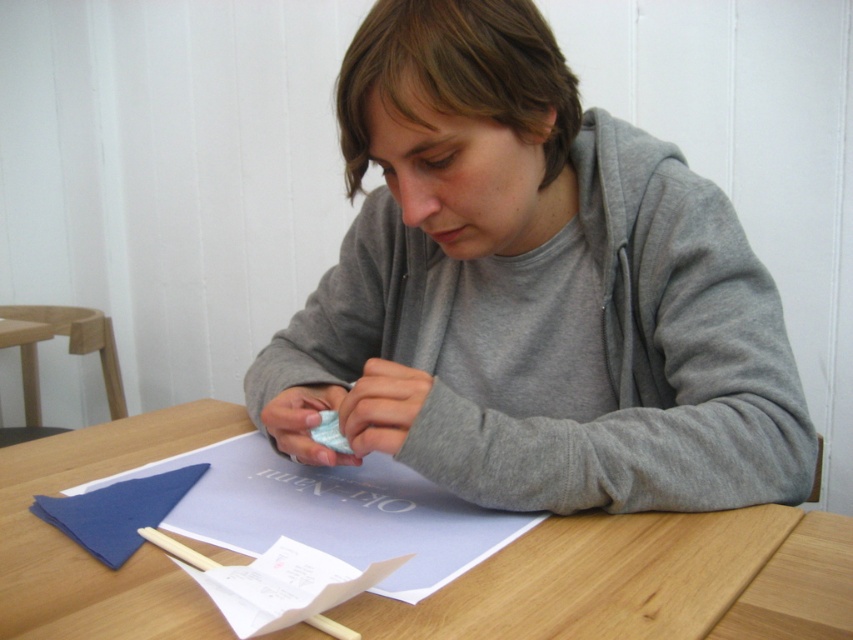
You are a photographer standing 24 inches away from the table where the gray cotton hoodie at center is located. Can you safely step forward to take a closer photo without disturbing the origami setup?

The gray cotton hoodie at center is 22.18 inches away from the camera, so stepping forward to 24 inches would actually move you further away. Therefore, you can safely step forward without disturbing the origami setup.

You are a fashion designer observing the scene. You need to determine if the gray cotton hoodie at center can be placed on the wooden table at center without hanging off the edge. Can it fit vertically?

The gray cotton hoodie at center is much taller than the wooden table at center, so placing it vertically would cause it to hang off the edges.